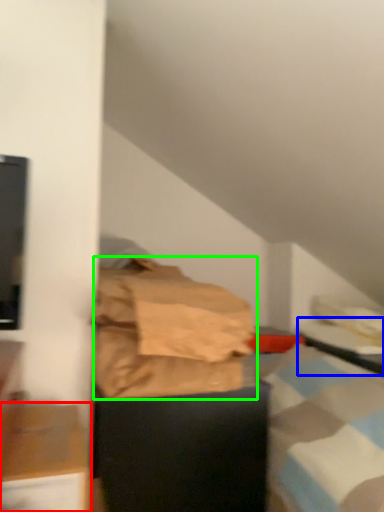
Question: Which is farther away from furniture (highlighted by a red box)? table (highlighted by a blue box) or material (highlighted by a green box)?

Choices:
 (A) table
 (B) material

Answer: (A)